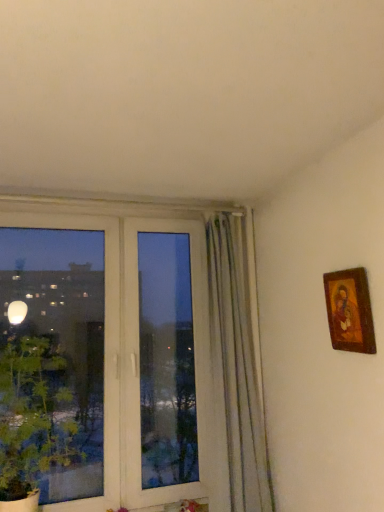
Question: Considering the relative positions of green leafy plant at left and wooden-framed painting at upper right in the image provided, is green leafy plant at left to the right of wooden-framed painting at upper right from the viewer's perspective?

Choices:
 (A) no
 (B) yes

Answer: (A)

Question: Is green leafy plant at left not within wooden-framed painting at upper right?

Choices:
 (A) yes
 (B) no

Answer: (A)

Question: Considering the relative sizes of green leafy plant at left and wooden-framed painting at upper right in the image provided, is green leafy plant at left thinner than wooden-framed painting at upper right?

Choices:
 (A) yes
 (B) no

Answer: (B)

Question: Is green leafy plant at left smaller than wooden-framed painting at upper right?

Choices:
 (A) yes
 (B) no

Answer: (B)

Question: From a real-world perspective, is green leafy plant at left physically below wooden-framed painting at upper right?

Choices:
 (A) yes
 (B) no

Answer: (A)

Question: Can you confirm if green leafy plant at left is wider than wooden-framed painting at upper right?

Choices:
 (A) yes
 (B) no

Answer: (A)

Question: Are wooden-framed painting at upper right and green leafy plant at left far apart?

Choices:
 (A) no
 (B) yes

Answer: (B)

Question: From a real-world perspective, is wooden-framed painting at upper right positioned under green leafy plant at left based on gravity?

Choices:
 (A) no
 (B) yes

Answer: (A)

Question: Does wooden-framed painting at upper right have a greater height compared to green leafy plant at left?

Choices:
 (A) yes
 (B) no

Answer: (B)

Question: Does wooden-framed painting at upper right have a lesser width compared to green leafy plant at left?

Choices:
 (A) yes
 (B) no

Answer: (A)

Question: From the image's perspective, is wooden-framed painting at upper right under green leafy plant at left?

Choices:
 (A) no
 (B) yes

Answer: (A)

Question: Considering the relative sizes of wooden-framed painting at upper right and green leafy plant at left in the image provided, is wooden-framed painting at upper right smaller than green leafy plant at left?

Choices:
 (A) no
 (B) yes

Answer: (B)

Question: Considering their positions, is wooden-framed painting at upper right located in front of or behind green leafy plant at left?

Choices:
 (A) behind
 (B) front

Answer: (B)